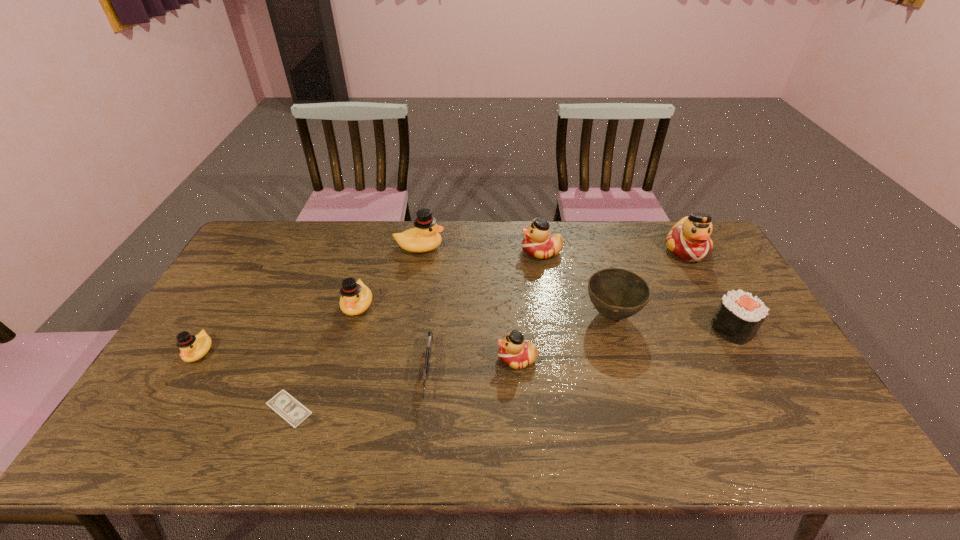
Where is `the rightmost red duck`? the rightmost red duck is located at coordinates pyautogui.click(x=689, y=239).

Locate an element on the screen. Image resolution: width=960 pixels, height=540 pixels. the biggest red duck is located at coordinates (689, 239).

At what (x,y) coordinates should I click in order to perform the action: click on the rightmost yellow duck. Please return your answer as a coordinate pair (x, y). Looking at the image, I should click on (425, 237).

At what (x,y) coordinates should I click in order to perform the action: click on the biggest yellow duck. Please return your answer as a coordinate pair (x, y). The width and height of the screenshot is (960, 540). Looking at the image, I should click on (425, 237).

Locate an element on the screen. This screenshot has width=960, height=540. the second biggest red duck is located at coordinates (538, 242).

Where is `the second biggest yellow duck`? Image resolution: width=960 pixels, height=540 pixels. the second biggest yellow duck is located at coordinates (356, 297).

Locate an element on the screen. the fourth farthest duck is located at coordinates (356, 297).

Find the location of a particular element. brown bowl is located at coordinates (617, 294).

Identify the location of the third object from right to left. The height and width of the screenshot is (540, 960). (617, 294).

The width and height of the screenshot is (960, 540). What are the coordinates of `sushi` in the screenshot? It's located at (739, 316).